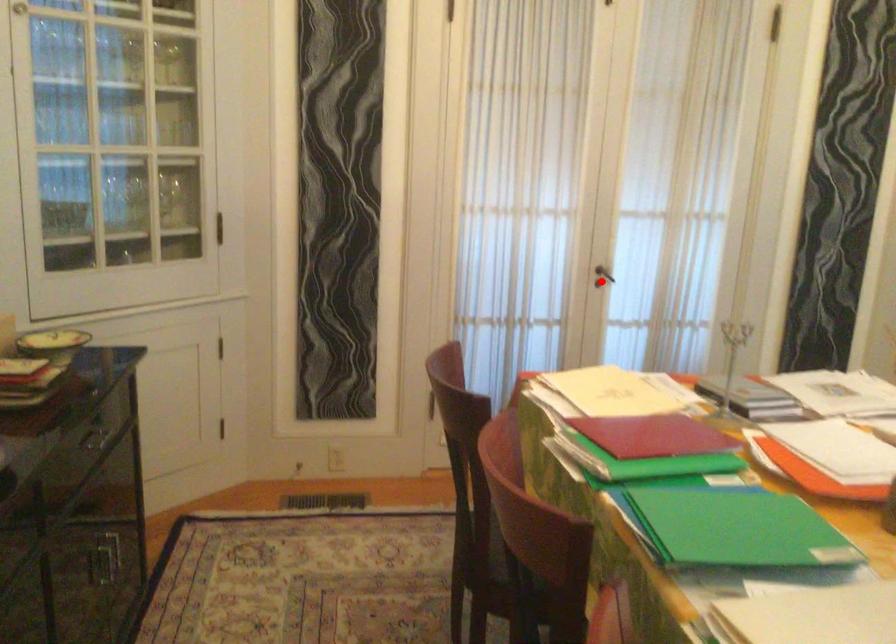
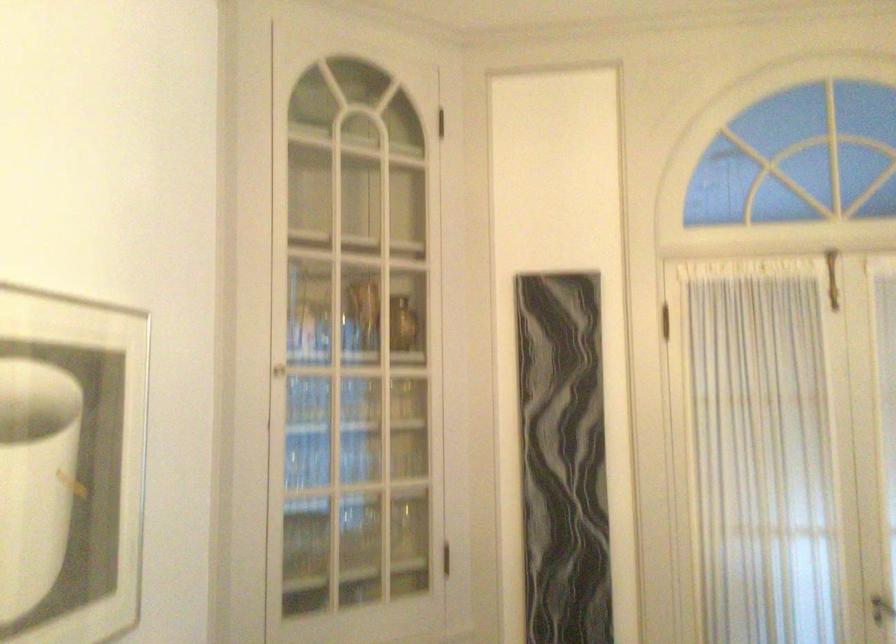
Locate, in the second image, the point that corresponds to the highlighted location in the first image.

(882, 609)